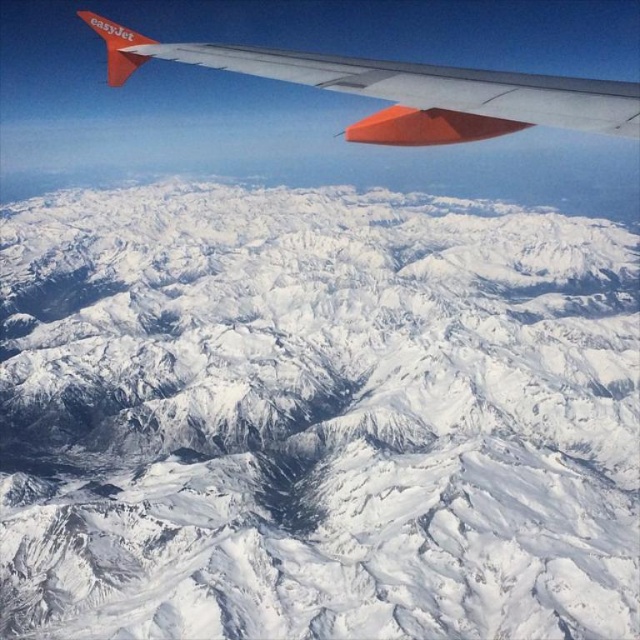
You are a pilot flying an EasyJet plane and notice the snowy rocky mountain range at center and the matte orange wing at upper left from your window. Which object appears taller in the view?

The matte orange wing at upper left appears taller than the snowy rocky mountain range at center because the wing is part of the aircraft and closer to the window, making it look larger despite the mountains being physically taller.

You are a passenger on an airplane and you look out the window. You see the snowy rocky mountain range at center and the matte orange wing at upper left. Which object is closer to you?

The matte orange wing at upper left is closer to you because it is positioned above the snowy rocky mountain range at center, which is further away.

You are a passenger on an EasyJet flight and want to take a photo of the snow mountain through the airplane window. The camera you have can only focus on objects within 150 meters. Is the point at coordinate point (x=428, y=529) in the image within the camera focus range?

The point at coordinate point (x=428, y=529) is 172.24 meters away from the camera, which is beyond the camera focus range of 150 meters. Therefore, the camera cannot focus on that point.